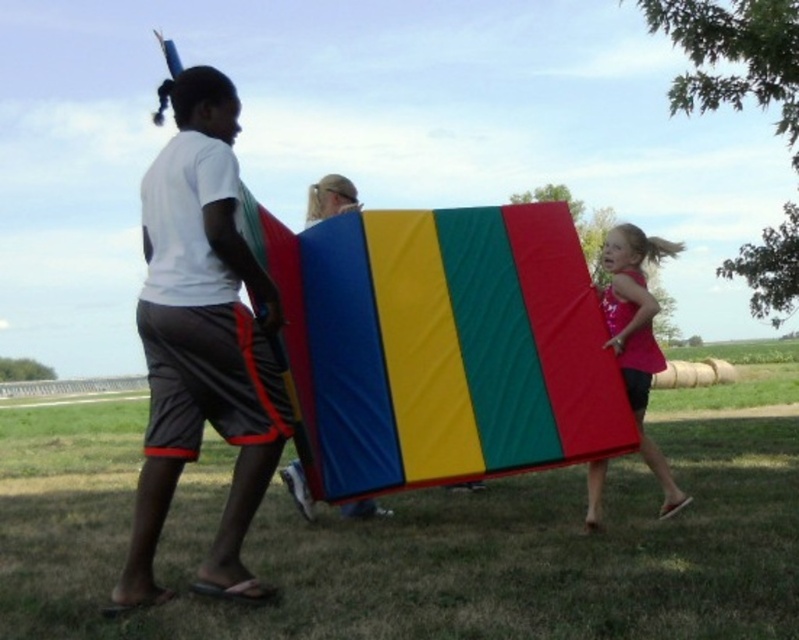
Can you confirm if white matte t-shirt at left is positioned above matte fabric board at center?

Incorrect, white matte t-shirt at left is not positioned above matte fabric board at center.

Is point (280, 440) behind point (283, 474)?

No.

Identify the location of white matte t-shirt at left. (201, 340).

Does point (175, 358) come farther from viewer compared to point (656, 356)?

No, (175, 358) is closer to viewer.

Is point (156, 435) less distant than point (642, 237)?

Yes, point (156, 435) is in front of point (642, 237).

This screenshot has width=799, height=640. In order to click on white matte t-shirt at left in this screenshot , I will do `click(201, 340)`.

Where is `white matte t-shirt at left`? The image size is (799, 640). white matte t-shirt at left is located at coordinates (201, 340).

Is textured fabric parachute at center to the right of white matte t-shirt at left from the viewer's perspective?

Indeed, textured fabric parachute at center is positioned on the right side of white matte t-shirt at left.

This screenshot has height=640, width=799. I want to click on textured fabric parachute at center, so click(451, 348).